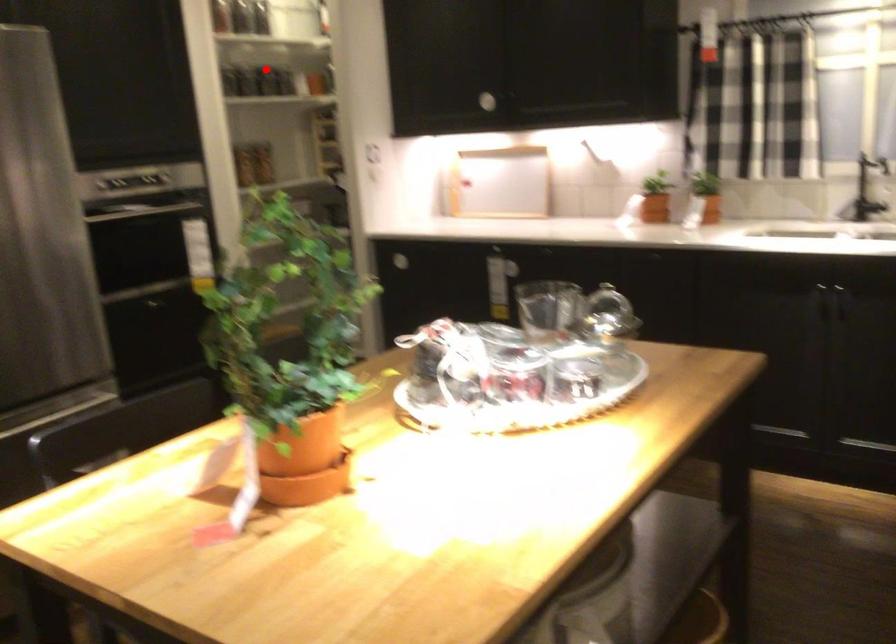
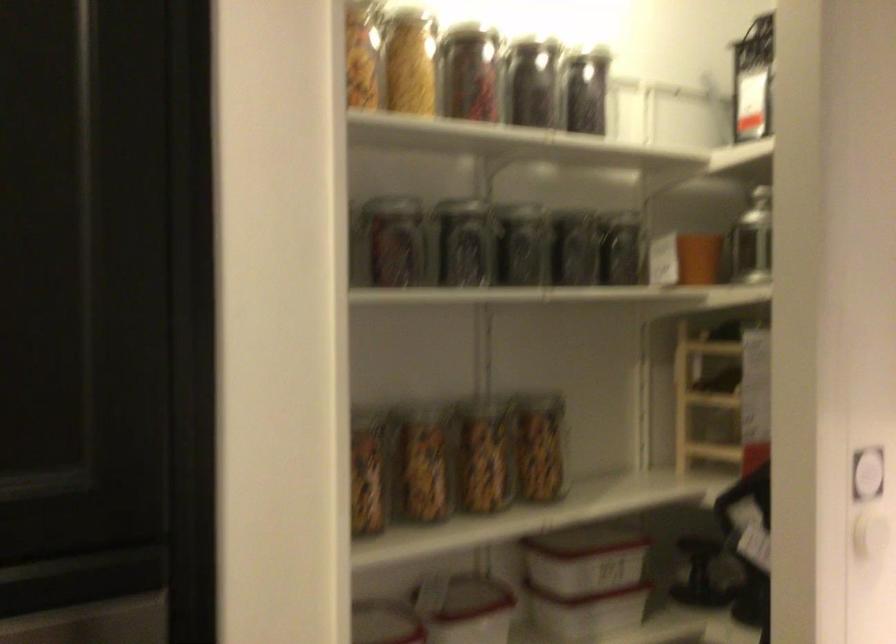
Question: I am providing you with two images of the same scene from different viewpoints. Image1 has a red point marked. In image2, the corresponding 3D location appears at what relative position? Reply with the corresponding letter.

Choices:
 (A) Closer
 (B) Farther

Answer: (A)